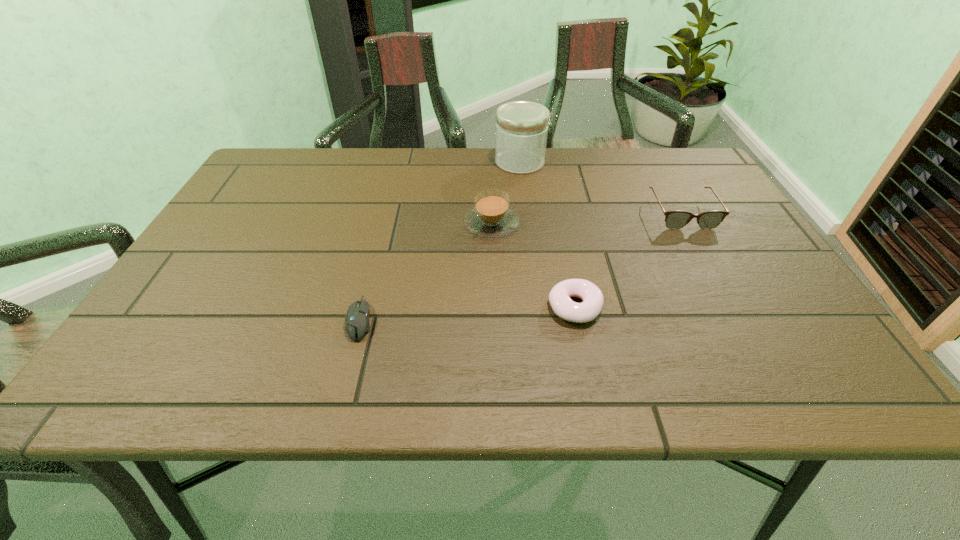
This screenshot has width=960, height=540. In order to click on jar in this screenshot , I will do `click(521, 126)`.

What are the coordinates of `the farthest object` in the screenshot? It's located at (521, 126).

The height and width of the screenshot is (540, 960). Identify the location of cappuccino. [491, 217].

Identify the location of spectacles. (676, 219).

Locate an element on the screen. The image size is (960, 540). the third shortest object is located at coordinates (676, 219).

Find the location of a particular element. doughnut is located at coordinates (563, 306).

I want to click on the leftmost object, so click(357, 317).

Find the location of a particular element. computer mouse is located at coordinates (357, 317).

Locate an element on the screen. The width and height of the screenshot is (960, 540). vacant space located on the right of the tallest object is located at coordinates (672, 162).

This screenshot has width=960, height=540. I want to click on free space located 0.150m on the right of the cappuccino, so click(580, 224).